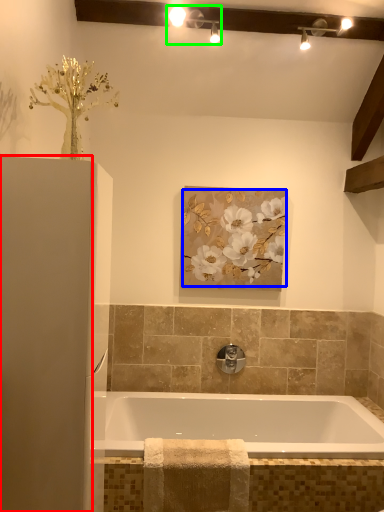
Question: Which object is positioned closest to screen door (highlighted by a red box)? Select from floral arrangement (highlighted by a blue box) and light fixture (highlighted by a green box).

Choices:
 (A) floral arrangement
 (B) light fixture

Answer: (A)